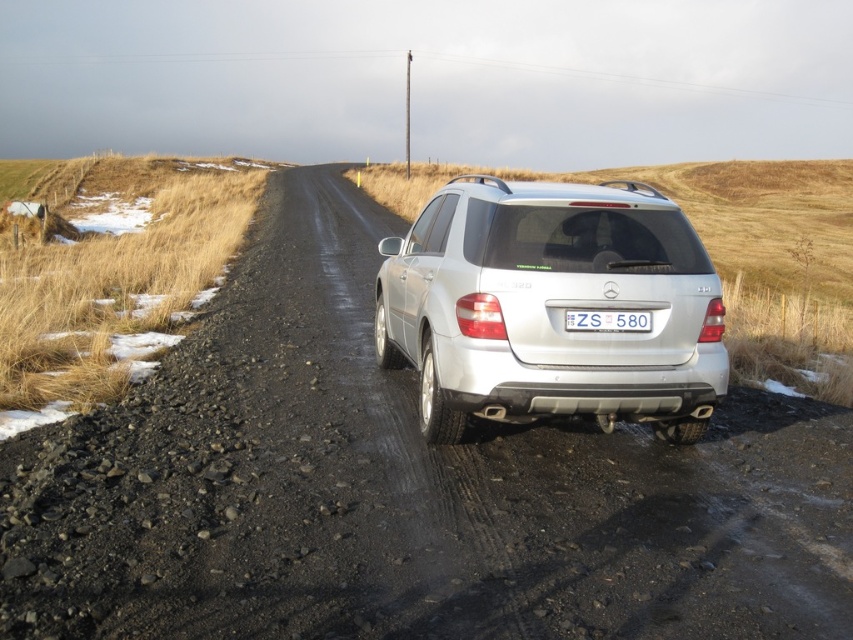
Consider the image. You are a photographer trying to capture the silver metallic suv at center and the white plastic license plate at center in a single frame. Based on their positions, will the suv appear higher up in the photo compared to the license plate?

The silver metallic suv at center is above the white plastic license plate at center, so yes, the suv will appear higher up in the photo compared to the license plate.

You are a delivery driver who needs to park your truck next to the silver metallic suv at center. However, there is a white plastic license plate at center in the way. Can you safely park your truck without hitting the license plate?

The silver metallic suv at center might be wider than white plastic license plate at center, so there is a possibility that the truck could hit the license plate if it is wider. It would be safer to adjust the parking position to avoid collision.

You are a hiker who has just finished a long trek and is standing at the point marked by the coordinates point (402, 490). You want to reach the silver Mercedes Benz SUV parked on the gravel road. According to the image, which direction should you head to reach the vehicle?

The point (402, 490) marks dirt track at center. The silver Mercedes Benz SUV is parked on the gravel road. Since the SUV is on the gravel road and the point is at the center of the dirt track, you should head towards the gravel road from the dirt track to reach the SUV.